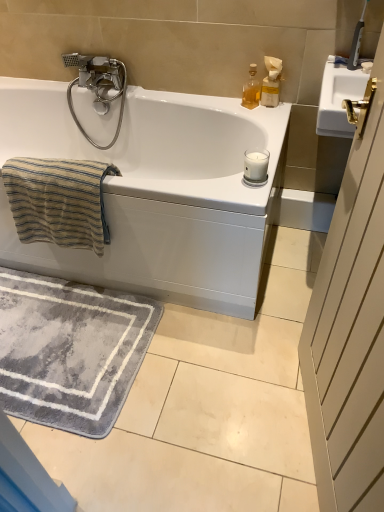
Locate an element on the screen. free space to the back side of white wood screen door at right is located at coordinates (253, 345).